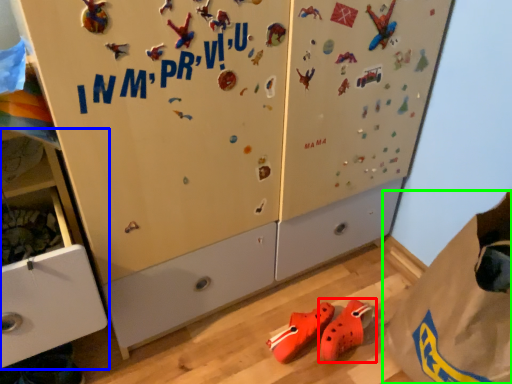
Question: Based on their relative distances, which object is farther from footwear (highlighted by a red box)? Choose from cabinetry (highlighted by a blue box) and paper bag (highlighted by a green box).

Choices:
 (A) cabinetry
 (B) paper bag

Answer: (A)